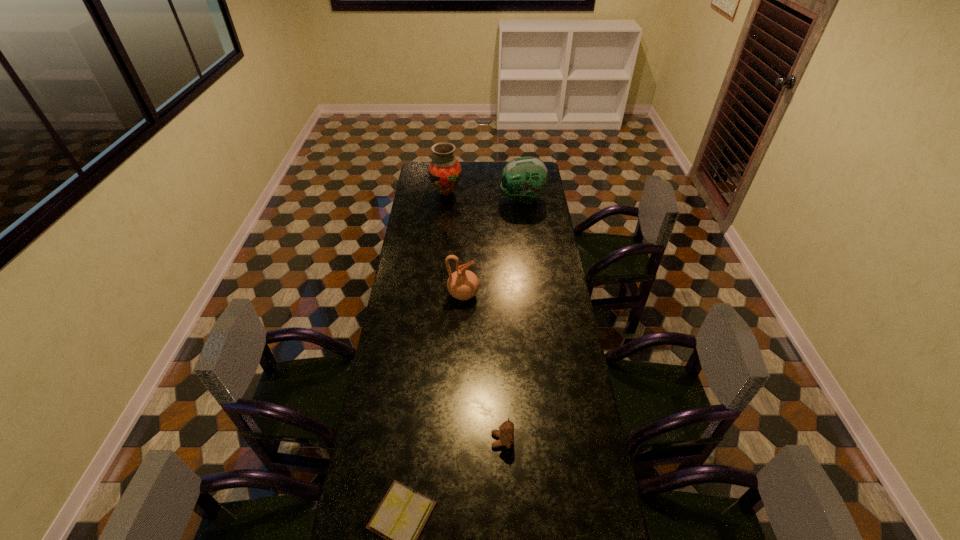
At what (x,y) coordinates should I click in order to perform the action: click on vase. Please return your answer as a coordinate pair (x, y). This screenshot has height=540, width=960. Looking at the image, I should click on (444, 171).

In order to click on football helmet in this screenshot , I will do `click(524, 178)`.

The width and height of the screenshot is (960, 540). Find the location of `pottery`. pottery is located at coordinates (463, 284).

Identify the location of the fourth tallest object. (506, 431).

Locate an element on the screen. teddy bear is located at coordinates (506, 431).

The height and width of the screenshot is (540, 960). I want to click on vacant space located 0.390m on the right of the vase, so click(530, 192).

Where is `blank space located on the visor of the football helmet`? This screenshot has width=960, height=540. blank space located on the visor of the football helmet is located at coordinates (442, 199).

What are the coordinates of `vacant space situated 0.100m on the visor of the football helmet` in the screenshot? It's located at (482, 199).

You are a GUI agent. You are given a task and a screenshot of the screen. Output one action in this format:
    pyautogui.click(x=<x>, y=<y>)
    Task: Click on the vacant space located 0.100m on the visor of the football helmet
    The image size is (960, 540).
    Given the screenshot: What is the action you would take?
    pyautogui.click(x=482, y=199)

What are the coordinates of `free point located on the spout of the pottery` in the screenshot? It's located at (521, 294).